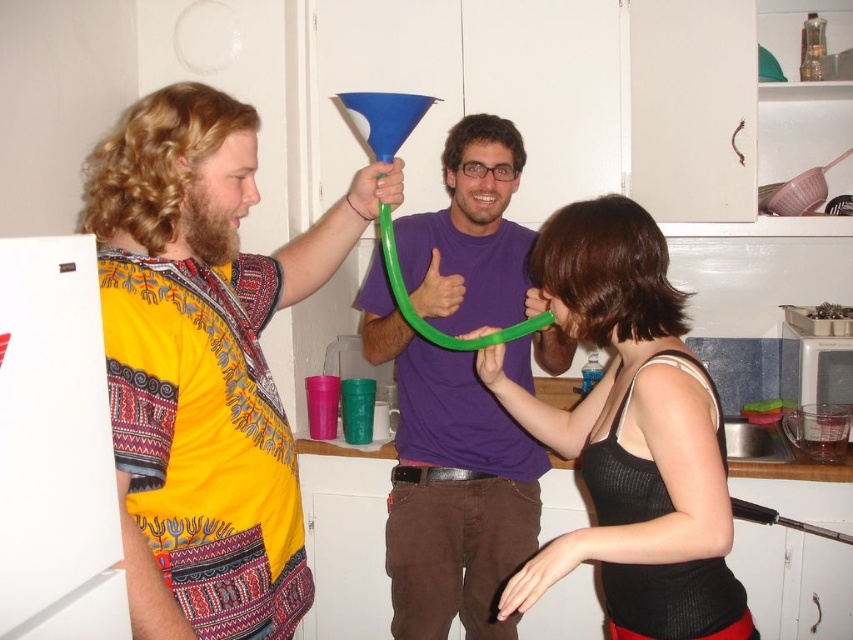
You are observing two people in a kitchen scene. The first person is wearing a matte yellow shirt at center, and the second is wearing a purple matte shirt at center. Which of these two shirts is located to the left when viewed from the perspective of someone facing the image?

The matte yellow shirt at center is positioned on the left side of the purple matte shirt at center, so the matte yellow shirt at center is to the left.